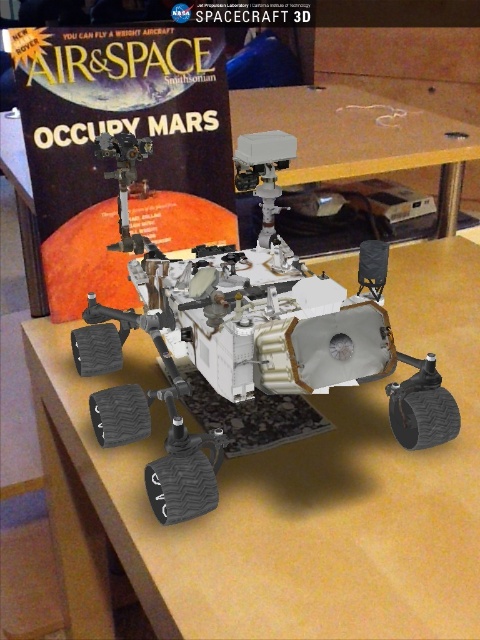
Can you confirm if light brown wood table at center is taller than wooden table at center?

Correct, light brown wood table at center is much taller as wooden table at center.

Between point (336, 416) and point (232, 108), which one is positioned behind?

Point (232, 108)

Is point (434, 250) closer to camera compared to point (384, 122)?

Yes, point (434, 250) is closer to viewer.

Where is `light brown wood table at center`? light brown wood table at center is located at coordinates (283, 493).